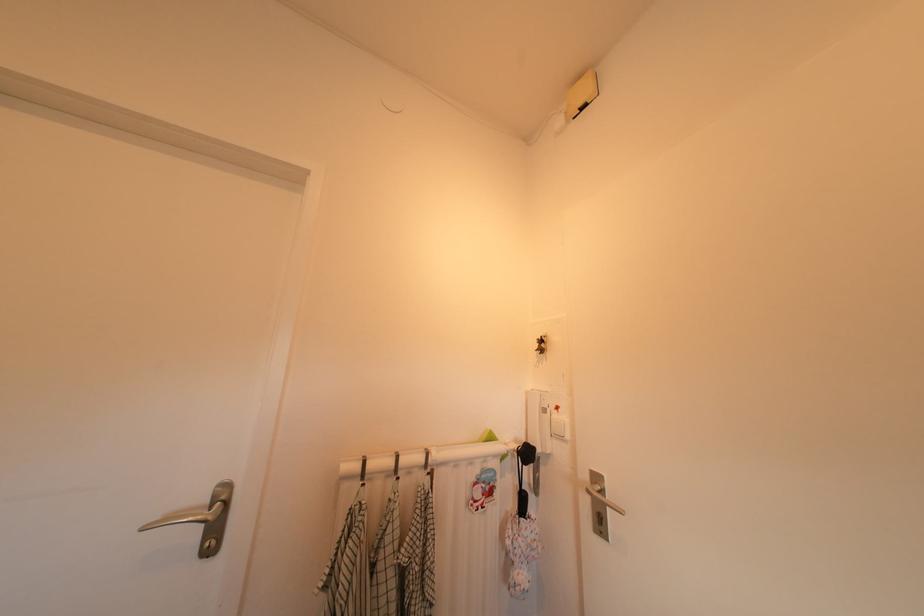
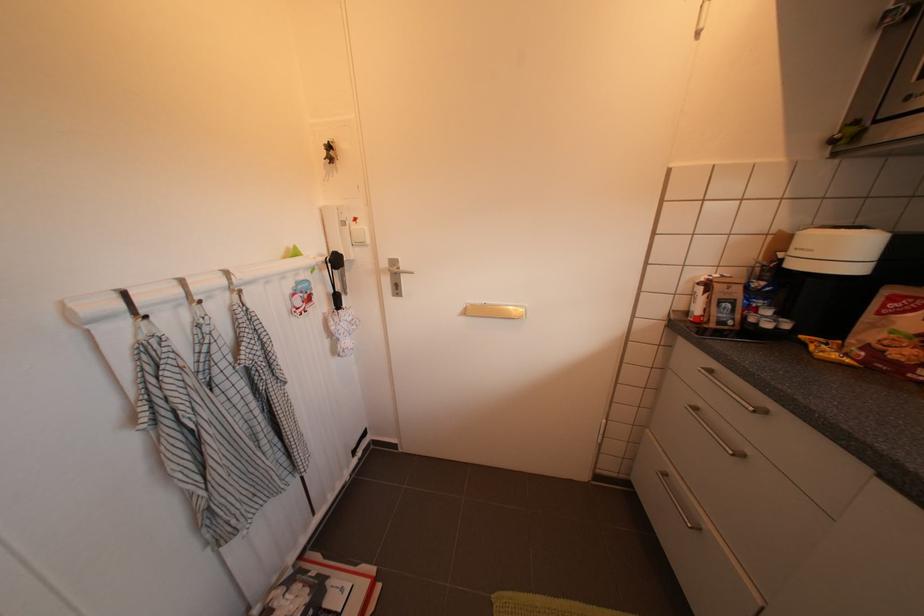
The first image is from the beginning of the video and the second image is from the end. How did the camera likely rotate when shooting the video?

The camera's rotation is toward right-down.